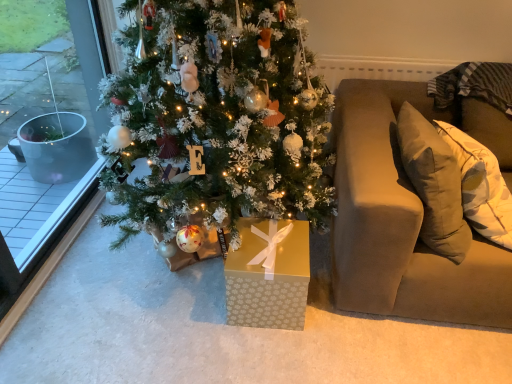
The height and width of the screenshot is (384, 512). What are the coordinates of `free spot in front of gold paper gift box at center` in the screenshot? It's located at (270, 354).